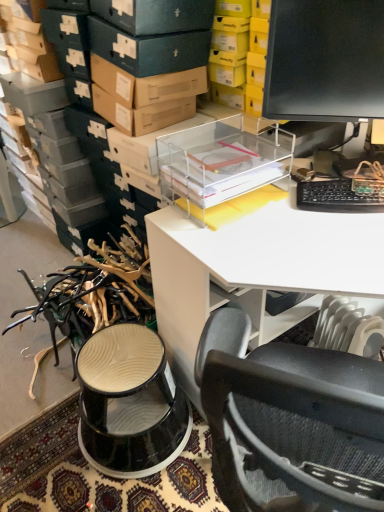
The height and width of the screenshot is (512, 384). In order to click on free space in front of black plastic keyboard at right in this screenshot , I will do `click(348, 247)`.